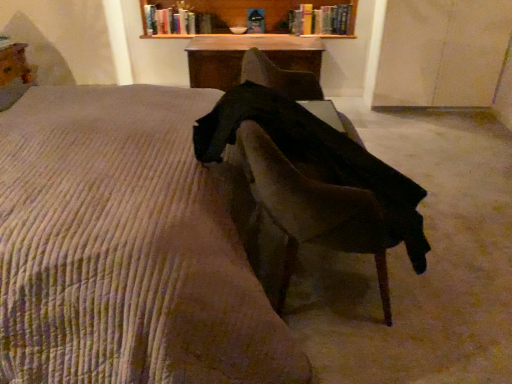
Find the location of a particular element. vacant point above hardcover book at upper center, which is the second book in left-to-right order (from a real-world perspective) is located at coordinates (332, 3).